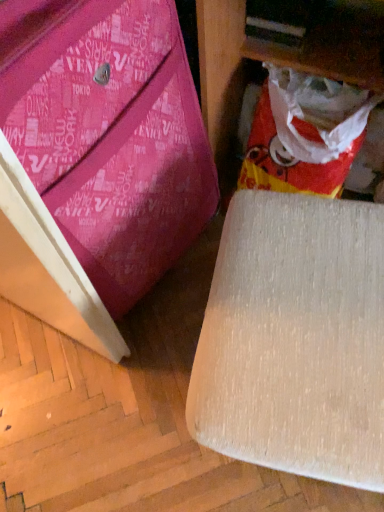
Find the location of a particular element. vacant space positioned to the left of beige fabric chair at lower right, the first furniture from the right is located at coordinates (134, 413).